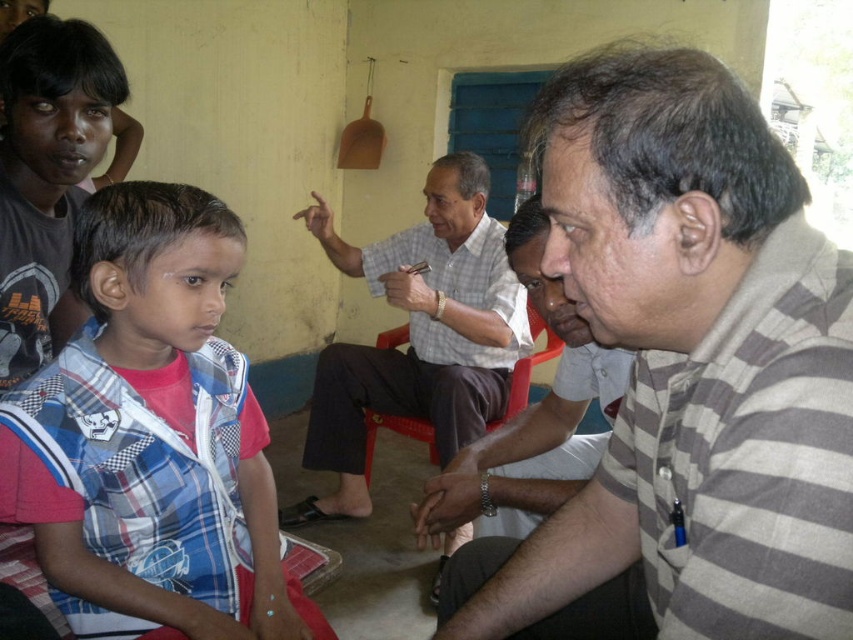
Question: Can you confirm if gray striped shirt at center is positioned to the left of matte black shirt at upper left?

Choices:
 (A) no
 (B) yes

Answer: (A)

Question: Which of the following is the closest to the observer?

Choices:
 (A) gray striped shirt at center
 (B) red plastic chair at center
 (C) matte black shirt at upper left
 (D) striped cotton shirt at center

Answer: (A)

Question: Which point appears farthest from the camera in this image?

Choices:
 (A) (13, 349)
 (B) (151, 596)
 (C) (432, 451)

Answer: (C)

Question: Is checkered fabric shirt at center to the left of striped cotton shirt at center from the viewer's perspective?

Choices:
 (A) yes
 (B) no

Answer: (A)

Question: Can you confirm if gray striped shirt at center is positioned below striped cotton shirt at center?

Choices:
 (A) yes
 (B) no

Answer: (A)

Question: Which of the following is the closest to the observer?

Choices:
 (A) (115, 374)
 (B) (376, 292)
 (C) (10, 234)
 (D) (433, 529)

Answer: (A)